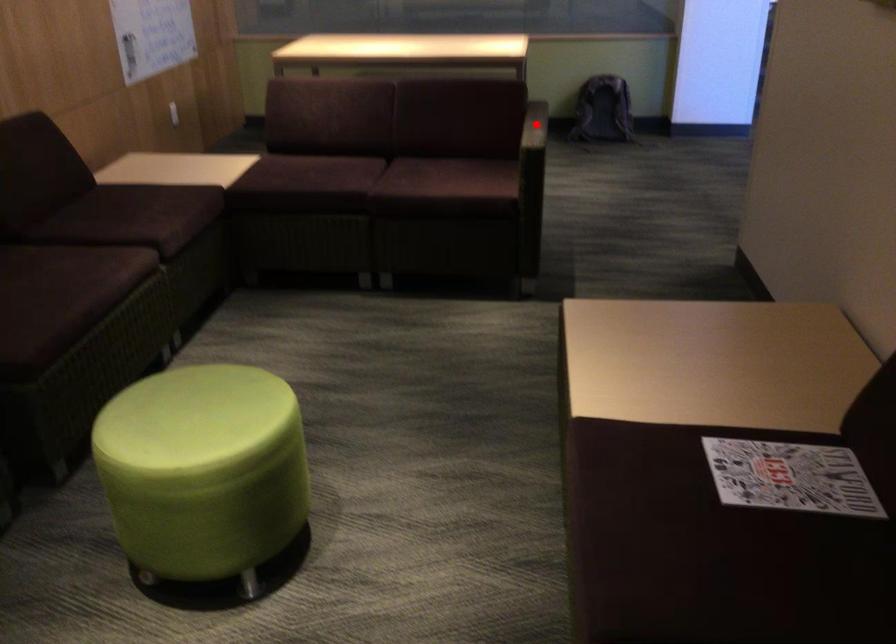
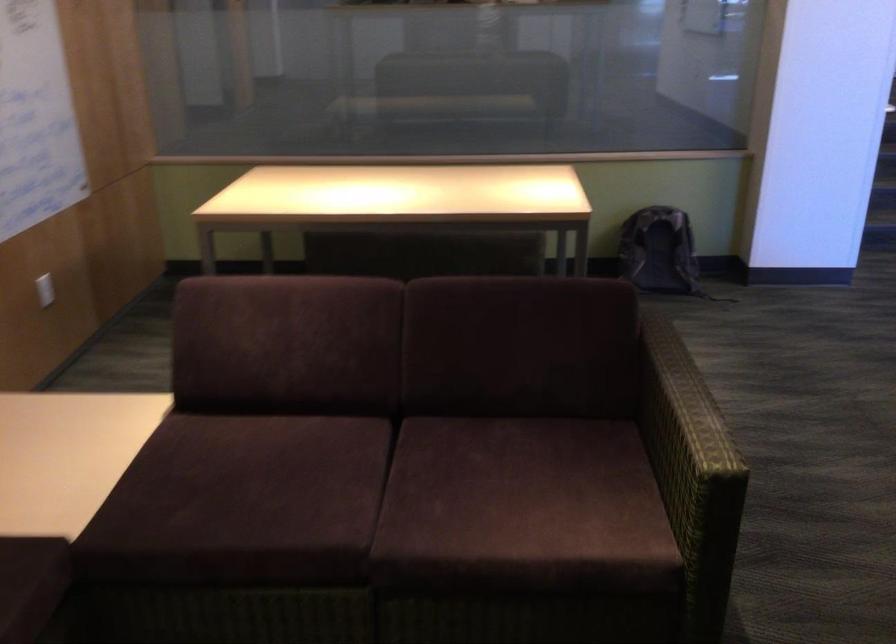
In the second image, find the point that corresponds to the highlighted location in the first image.

(682, 404)